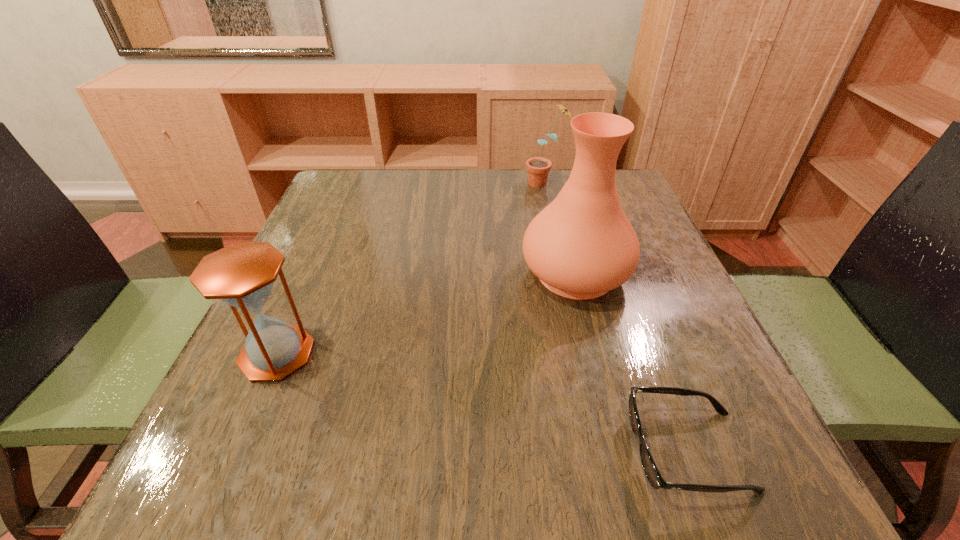
The height and width of the screenshot is (540, 960). What are the coordinates of `object that is at the near right corner` in the screenshot? It's located at (652, 473).

Find the location of `free space at the far edge of the desktop`. free space at the far edge of the desktop is located at coordinates (484, 200).

In the image, there is a desktop. Where is `free space at the near edge`? This screenshot has height=540, width=960. free space at the near edge is located at coordinates (550, 503).

Identify the location of vacant space at the left edge of the desktop. The width and height of the screenshot is (960, 540). (313, 239).

Find the location of a particular element. The image size is (960, 540). free spot at the right edge of the desktop is located at coordinates (676, 352).

At what (x,y) coordinates should I click in order to perform the action: click on blank space at the near left corner. Please return your answer as a coordinate pair (x, y). The width and height of the screenshot is (960, 540). Looking at the image, I should click on (275, 490).

Where is `vacant area that lies between the farthest object and the hourglass`? This screenshot has height=540, width=960. vacant area that lies between the farthest object and the hourglass is located at coordinates (411, 268).

Locate an element on the screen. The width and height of the screenshot is (960, 540). unoccupied area between the leftmost object and the tallest object is located at coordinates (426, 314).

Locate an element on the screen. free space between the sunflower and the shortest object is located at coordinates coord(616,317).

The height and width of the screenshot is (540, 960). I want to click on free spot between the shortest object and the vase, so click(x=632, y=362).